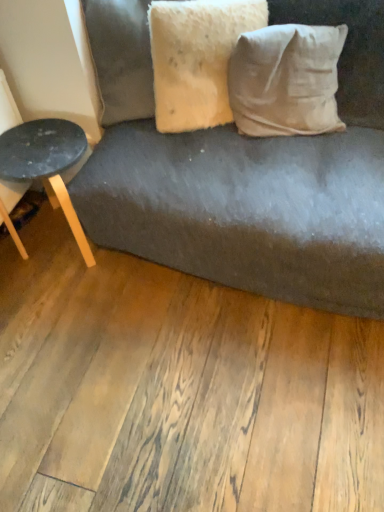
Describe the element at coordinates (46, 164) in the screenshot. I see `matte black stool at left` at that location.

Measure the distance between point [31,138] and camera.

The depth of point [31,138] is 4.97 feet.

At what (x,y) coordinates should I click in order to perform the action: click on white cotton pillow at upper right, which ranks as the 1th pillow in right-to-left order. Please return your answer as a coordinate pair (x, y). Image resolution: width=384 pixels, height=512 pixels. Looking at the image, I should click on (286, 80).

What are the coordinates of `fuzzy beige pillow at upper center, placed as the second pillow when sorted from right to left` in the screenshot? It's located at (197, 58).

How far apart are matte black stool at left and white cotton pillow at upper right, the 2th pillow when ordered from left to right?

The distance of matte black stool at left from white cotton pillow at upper right, the 2th pillow when ordered from left to right, is 28.11 inches.

Can you see matte black stool at left touching white cotton pillow at upper right, which ranks as the 1th pillow in right-to-left order?

matte black stool at left and white cotton pillow at upper right, which ranks as the 1th pillow in right-to-left order, are not in contact.

Considering the relative sizes of matte black stool at left and white cotton pillow at upper right, the 2th pillow when ordered from left to right, in the image provided, is matte black stool at left thinner than white cotton pillow at upper right, the 2th pillow when ordered from left to right,?

A: No, matte black stool at left is not thinner than white cotton pillow at upper right, the 2th pillow when ordered from left to right.

Is matte black stool at left taller than white cotton pillow at upper right, which ranks as the 1th pillow in right-to-left order?

Indeed, matte black stool at left has a greater height compared to white cotton pillow at upper right, which ranks as the 1th pillow in right-to-left order.

Could matte black stool at left be considered to be inside white cotton pillow at upper right, which ranks as the 1th pillow in right-to-left order?

That's incorrect, matte black stool at left is not inside white cotton pillow at upper right, which ranks as the 1th pillow in right-to-left order.

In the scene shown: Does white cotton pillow at upper right, the 2th pillow when ordered from left to right, turn towards matte black stool at left?

No, white cotton pillow at upper right, the 2th pillow when ordered from left to right, is not aimed at matte black stool at left.

Is the depth of white cotton pillow at upper right, the 2th pillow when ordered from left to right, greater than that of matte black stool at left?

No, it is not.

Looking at this image, from a real-world perspective, is white cotton pillow at upper right, which ranks as the 1th pillow in right-to-left order, beneath matte black stool at left?

Actually, white cotton pillow at upper right, which ranks as the 1th pillow in right-to-left order, is physically above matte black stool at left in the real world.

Which of these two, white cotton pillow at upper right, which ranks as the 1th pillow in right-to-left order, or fuzzy beige pillow at upper center, the first pillow from the left, stands taller?

With more height is fuzzy beige pillow at upper center, the first pillow from the left.

Is white cotton pillow at upper right, which ranks as the 1th pillow in right-to-left order, not inside fuzzy beige pillow at upper center, placed as the second pillow when sorted from right to left?

Absolutely, white cotton pillow at upper right, which ranks as the 1th pillow in right-to-left order, is external to fuzzy beige pillow at upper center, placed as the second pillow when sorted from right to left.

Between white cotton pillow at upper right, which ranks as the 1th pillow in right-to-left order, and fuzzy beige pillow at upper center, the first pillow from the left, which one appears on the right side from the viewer's perspective?

white cotton pillow at upper right, which ranks as the 1th pillow in right-to-left order, is more to the right.

Is white cotton pillow at upper right, the 2th pillow when ordered from left to right, facing away from fuzzy beige pillow at upper center, placed as the second pillow when sorted from right to left?

No, white cotton pillow at upper right, the 2th pillow when ordered from left to right, is not facing away from fuzzy beige pillow at upper center, placed as the second pillow when sorted from right to left.

Is fuzzy beige pillow at upper center, placed as the second pillow when sorted from right to left, to the left of white cotton pillow at upper right, the 2th pillow when ordered from left to right, from the viewer's perspective?

Correct, you'll find fuzzy beige pillow at upper center, placed as the second pillow when sorted from right to left, to the left of white cotton pillow at upper right, the 2th pillow when ordered from left to right.

Is point (180, 24) positioned behind point (329, 76)?

No, (180, 24) is closer to viewer.

In terms of width, does fuzzy beige pillow at upper center, the first pillow from the left, look wider or thinner when compared to white cotton pillow at upper right, the 2th pillow when ordered from left to right?

Clearly, fuzzy beige pillow at upper center, the first pillow from the left, has less width compared to white cotton pillow at upper right, the 2th pillow when ordered from left to right.

Is the depth of fuzzy beige pillow at upper center, the first pillow from the left, less than that of white cotton pillow at upper right, the 2th pillow when ordered from left to right?

Yes, fuzzy beige pillow at upper center, the first pillow from the left, is in front of white cotton pillow at upper right, the 2th pillow when ordered from left to right.

From the matte black stool at left, count 2nd pillows forward and point to it. Please provide its 2D coordinates.

[(197, 58)]

Is matte black stool at left smaller than fuzzy beige pillow at upper center, the first pillow from the left?

No, matte black stool at left is not smaller than fuzzy beige pillow at upper center, the first pillow from the left.

In the scene shown: Considering the positions of objects matte black stool at left and fuzzy beige pillow at upper center, the first pillow from the left, in the image provided, who is in front, matte black stool at left or fuzzy beige pillow at upper center, the first pillow from the left,?

fuzzy beige pillow at upper center, the first pillow from the left, is more forward.

Is matte black stool at left oriented away from fuzzy beige pillow at upper center, placed as the second pillow when sorted from right to left?

matte black stool at left is not turned away from fuzzy beige pillow at upper center, placed as the second pillow when sorted from right to left.

Looking at this image, who is more distant, fuzzy beige pillow at upper center, placed as the second pillow when sorted from right to left, or matte black stool at left?

matte black stool at left is more distant.

Which is more to the left, fuzzy beige pillow at upper center, the first pillow from the left, or matte black stool at left?

Positioned to the left is matte black stool at left.

From the image's perspective, is fuzzy beige pillow at upper center, the first pillow from the left, positioned above or below matte black stool at left?

Clearly, from the image's perspective, fuzzy beige pillow at upper center, the first pillow from the left, is above matte black stool at left.

Locate an element on the screen. table located underneath the white cotton pillow at upper right, which ranks as the 1th pillow in right-to-left order (from a real-world perspective) is located at coordinates (46, 164).

Locate an element on the screen. table located on the left of white cotton pillow at upper right, the 2th pillow when ordered from left to right is located at coordinates (46, 164).

Estimate the real-world distances between objects in this image. Which object is closer to matte black stool at left, fuzzy beige pillow at upper center, the first pillow from the left, or white cotton pillow at upper right, the 2th pillow when ordered from left to right?

fuzzy beige pillow at upper center, the first pillow from the left, is positioned closer to the anchor matte black stool at left.

Which object lies further to the anchor point matte black stool at left, white cotton pillow at upper right, the 2th pillow when ordered from left to right, or fuzzy beige pillow at upper center, placed as the second pillow when sorted from right to left?

Based on the image, white cotton pillow at upper right, the 2th pillow when ordered from left to right, appears to be further to matte black stool at left.

Looking at the image, which one is located closer to white cotton pillow at upper right, the 2th pillow when ordered from left to right, fuzzy beige pillow at upper center, placed as the second pillow when sorted from right to left, or matte black stool at left?

fuzzy beige pillow at upper center, placed as the second pillow when sorted from right to left, is closer to white cotton pillow at upper right, the 2th pillow when ordered from left to right.

When comparing their distances from white cotton pillow at upper right, which ranks as the 1th pillow in right-to-left order, does matte black stool at left or fuzzy beige pillow at upper center, the first pillow from the left, seem closer?

The object closer to white cotton pillow at upper right, which ranks as the 1th pillow in right-to-left order, is fuzzy beige pillow at upper center, the first pillow from the left.

Considering their positions, is matte black stool at left positioned closer to fuzzy beige pillow at upper center, placed as the second pillow when sorted from right to left, than white cotton pillow at upper right, which ranks as the 1th pillow in right-to-left order?

white cotton pillow at upper right, which ranks as the 1th pillow in right-to-left order, is closer to fuzzy beige pillow at upper center, placed as the second pillow when sorted from right to left.

Estimate the real-world distances between objects in this image. Which object is further from fuzzy beige pillow at upper center, placed as the second pillow when sorted from right to left, white cotton pillow at upper right, the 2th pillow when ordered from left to right, or matte black stool at left?

Among the two, matte black stool at left is located further to fuzzy beige pillow at upper center, placed as the second pillow when sorted from right to left.

Find the location of `pillow between matte black stool at left and white cotton pillow at upper right, the 2th pillow when ordered from left to right, from left to right`. pillow between matte black stool at left and white cotton pillow at upper right, the 2th pillow when ordered from left to right, from left to right is located at coordinates (197, 58).